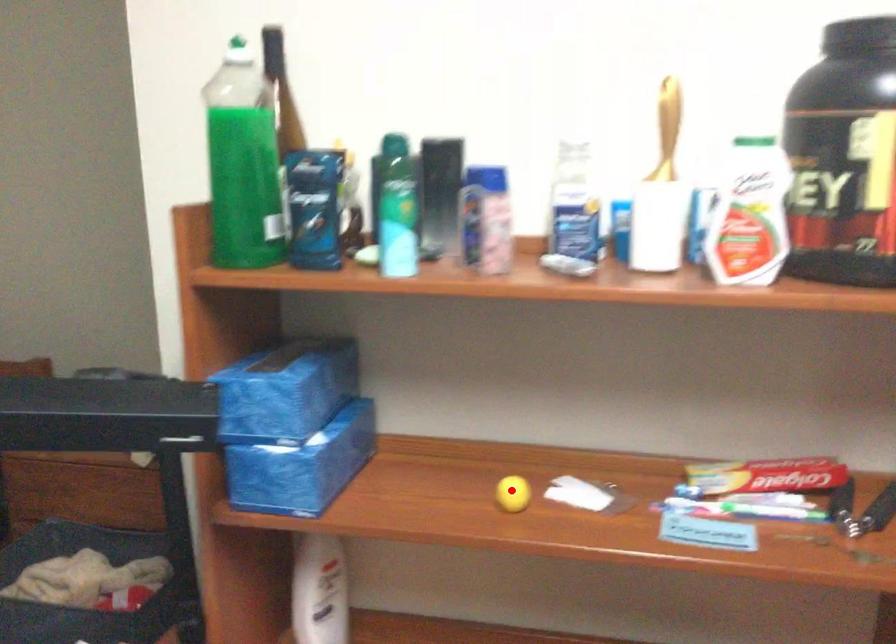
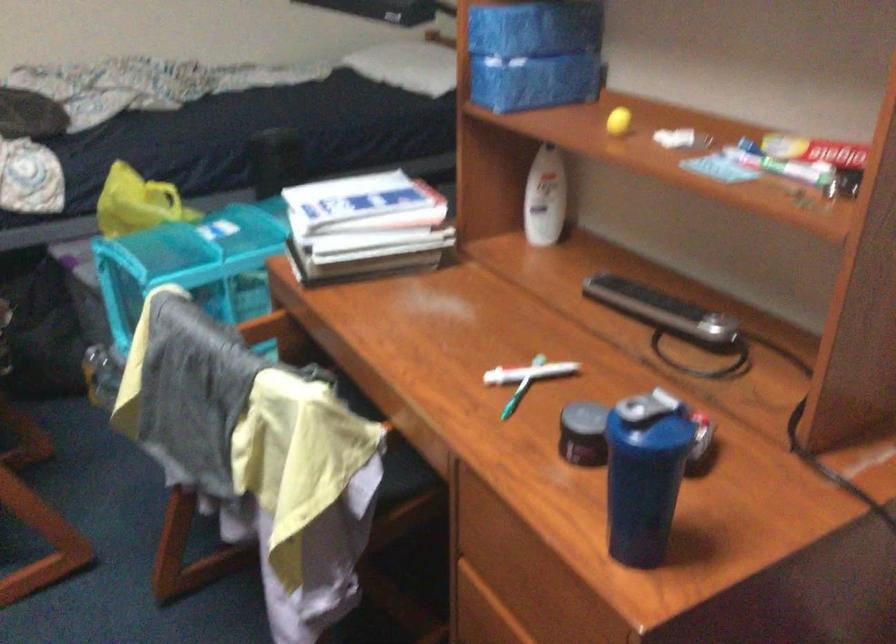
Question: I am providing you with two images of the same scene from different viewpoints. A red point is shown in image1. For the corresponding object point in image2, is it positioned nearer or farther from the camera?

Choices:
 (A) Nearer
 (B) Farther

Answer: (B)